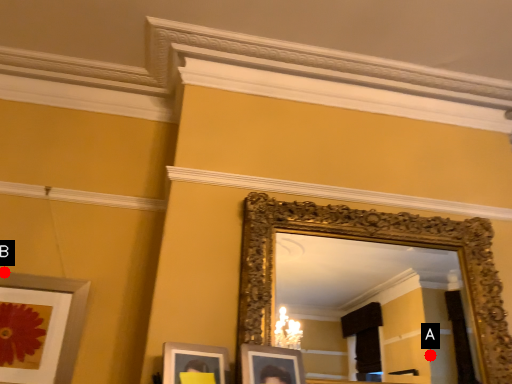
Question: Two points are circled on the image, labeled by A and B beside each circle. Among these points, which one is farthest from the camera?

Choices:
 (A) A is further
 (B) B is further

Answer: (A)